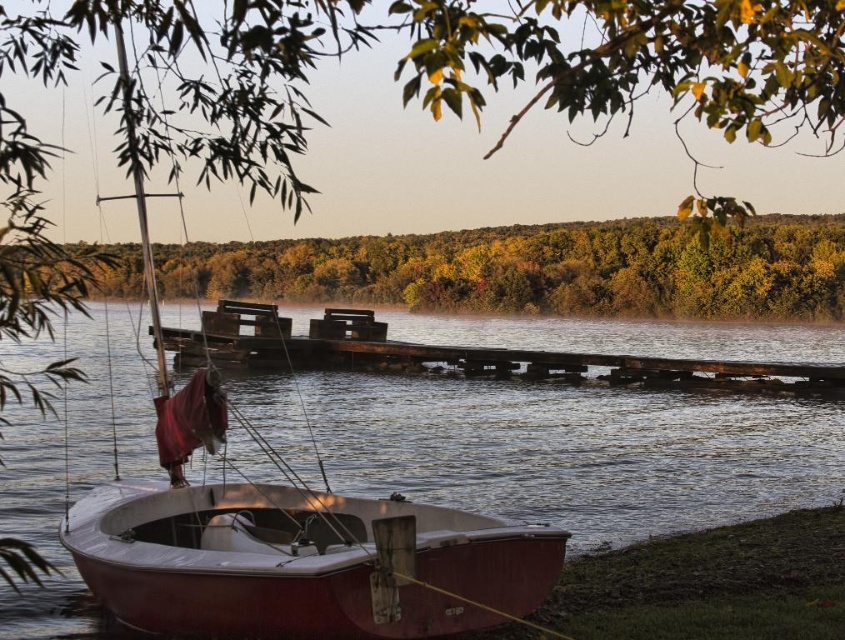
Question: Estimate the real-world distances between objects in this image. Which object is closer to the green leafy trees at upper center?

Choices:
 (A) green leafy tree at upper center
 (B) weathered wood dock at center
 (C) wooden sailboat at lower left

Answer: (A)

Question: Does green leafy tree at upper center appear on the right side of weathered wood dock at center?

Choices:
 (A) no
 (B) yes

Answer: (A)

Question: Which point appears farthest from the camera in this image?

Choices:
 (A) (369, 294)
 (B) (402, 208)
 (C) (221, 621)

Answer: (B)

Question: Does wooden sailboat at lower left have a greater width compared to green leafy trees at upper center?

Choices:
 (A) yes
 (B) no

Answer: (B)

Question: Which object is the closest to the green leafy tree at upper center?

Choices:
 (A) weathered wood dock at center
 (B) wooden sailboat at lower left
 (C) green leafy trees at upper center

Answer: (B)

Question: Is green leafy trees at upper center positioned at the back of weathered wood dock at center?

Choices:
 (A) yes
 (B) no

Answer: (B)